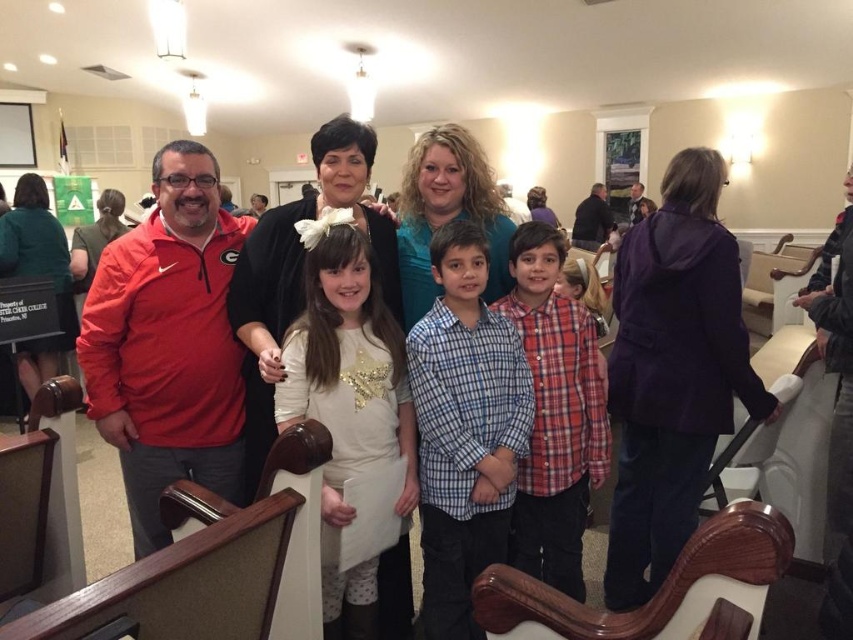
You are a photographer trying to adjust the lighting for a group photo. You notice the blue plaid shirt at center and the white sequined dress at center. Which of these two items requires more space in the frame to avoid being cut off?

The white sequined dress at center requires more space in the frame because it has a greater width compared to the blue plaid shirt at center.